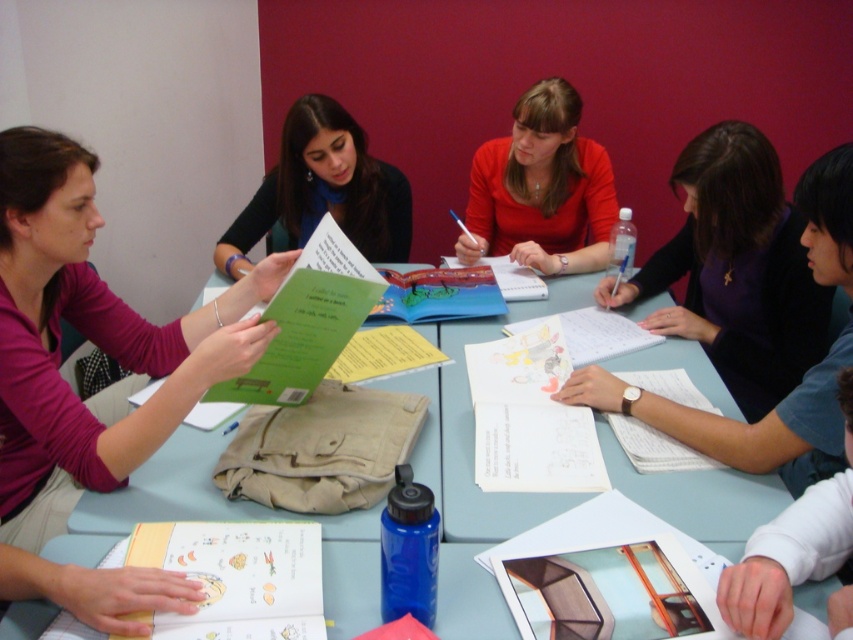
You are a student trying to organize your study materials on the table. You have a matte green book at center that you need to place. Where exactly should you position it to match the image?

The matte green book at center should be positioned at point coordinates (x=323, y=189) as specified in the description.

You are a student who needs to reach both the matte green book at center and the green paper at center from your current position. Your arm can extend 60 centimeters. Can you reach both items without moving your chair?

The distance between the matte green book at center and the green paper at center is 76.67 centimeters. Since your arm can only extend 60 centimeters, you cannot reach both items without moving your chair.

You are a student sitting at the light blue plastic table at center. You need to reach the paper with illustrations at center to copy a diagram. Can you reach it without leaving your seat?

Result: The light blue plastic table at center is to the right of the paper with illustrations at center, so the paper with illustrations at center is on your left side. Since you are sitting at the table, you can likely reach the paper with illustrations at center without leaving your seat.